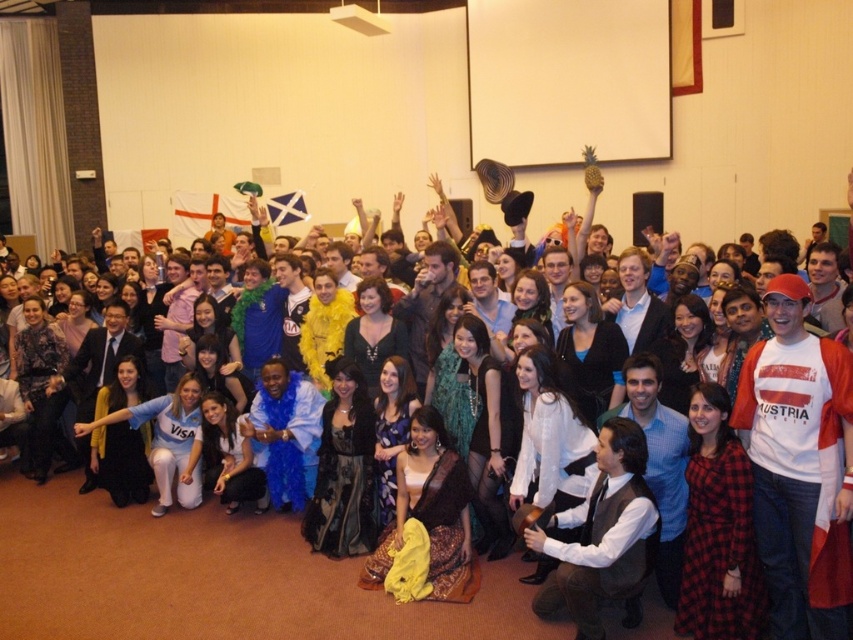
Consider the image. Which is above, yellow sheer fabric at center or teal sequined dress at center?

teal sequined dress at center is above.

Between point (469, 525) and point (469, 438), which one is positioned in front?

Positioned in front is point (469, 525).

Is point (428, 508) positioned in front of point (440, 376)?

That is True.

Locate an element on the screen. This screenshot has height=640, width=853. yellow sheer fabric at center is located at coordinates (433, 531).

Between white shirt at center and yellow sheer fabric at center, which one appears on the left side from the viewer's perspective?

white shirt at center

Based on the photo, which is below, white shirt at center or yellow sheer fabric at center?

Positioned lower is white shirt at center.

Is point (44, 582) in front of point (445, 570)?

No, (44, 582) is further to viewer.

Identify the location of white shirt at center. (212, 579).

Is black satin dress at center positioned in front of teal sequined dress at center?

Yes.

Between black satin dress at center and teal sequined dress at center, which one appears on the left side from the viewer's perspective?

black satin dress at center

You are a GUI agent. You are given a task and a screenshot of the screen. Output one action in this format:
    pyautogui.click(x=<x>, y=<y>)
    Task: Click on the black satin dress at center
    This screenshot has height=640, width=853.
    Given the screenshot: What is the action you would take?
    pyautogui.click(x=343, y=483)